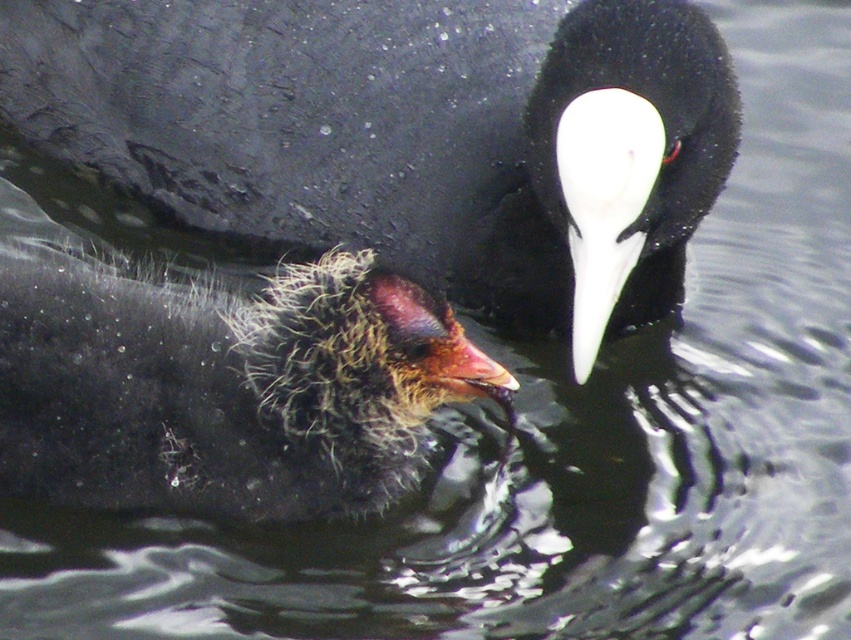
You are a wildlife photographer trying to capture a closeup shot of the fluffy downy chick at center and the white matte beak at center. From your current viewpoint, which object appears to be on the right side?

The white matte beak at center is positioned on the right side of the fluffy downy chick at center, so the white matte beak at center appears to be on the right side.

You are a birder observing two birds in the water. You notice two white beaks at the center of the image. Which beak, the white matte beak at center or the white glossy beak at center, is positioned to the right?

The white matte beak at center is positioned to the right of the white glossy beak at center.

Looking at this image, you are taking a photo of two birds in the water. You want to focus on the bird that is closer to you. Which point should you focus on, point (130, 397) or point (495, 376)?

Point (130, 397) is further to the camera than point (495, 376), so you should focus on point (130, 397) since it is closer to you.